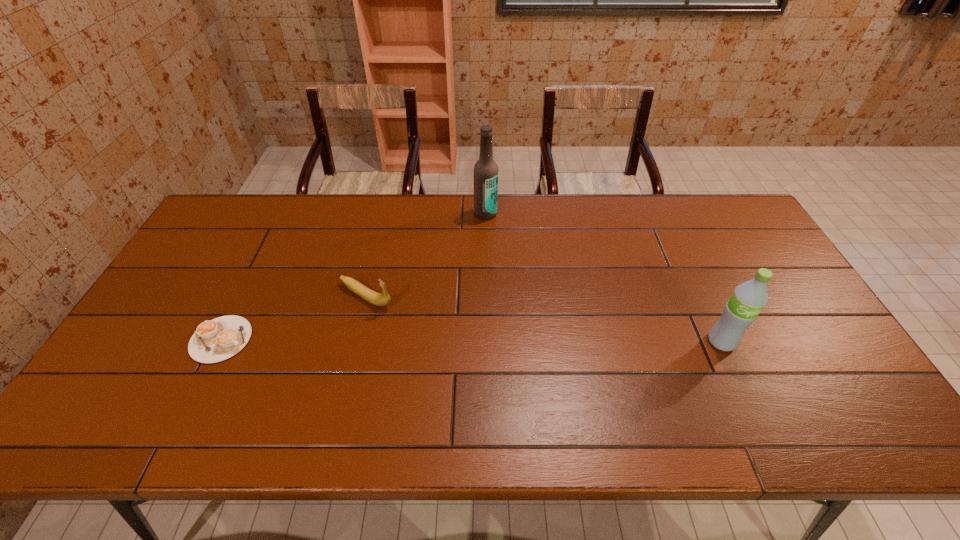
Find the location of a particular element. The height and width of the screenshot is (540, 960). cappuccino is located at coordinates (215, 340).

Where is `the shortest object`? the shortest object is located at coordinates (215, 340).

I want to click on the rightmost object, so click(x=741, y=310).

Image resolution: width=960 pixels, height=540 pixels. Find the location of `water bottle`. water bottle is located at coordinates pyautogui.click(x=741, y=310).

Where is `the second object from left to right`? This screenshot has height=540, width=960. the second object from left to right is located at coordinates (367, 294).

This screenshot has width=960, height=540. In order to click on banana in this screenshot , I will do `click(367, 294)`.

What are the coordinates of `beer bottle` in the screenshot? It's located at (485, 173).

Where is `the farthest object`? The height and width of the screenshot is (540, 960). the farthest object is located at coordinates (485, 173).

The image size is (960, 540). Identify the location of vacant region located on the right of the shortest object. (277, 339).

The height and width of the screenshot is (540, 960). Identify the location of vacant space situated on the back of the second tallest object. (682, 256).